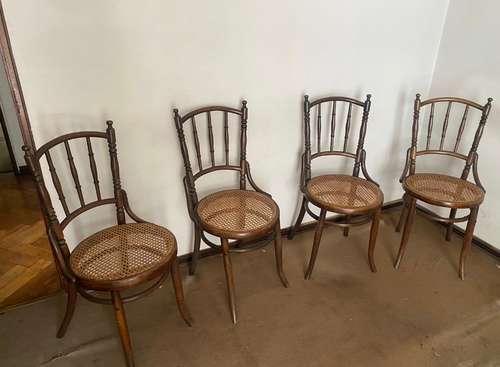
At what (x,y) coordinates should I click in order to perform the action: click on wooden trim on walls. Please return your answer as a coordinate pair (x, y). This screenshot has width=500, height=367. Looking at the image, I should click on (30, 129), (11, 142), (184, 256), (491, 248).